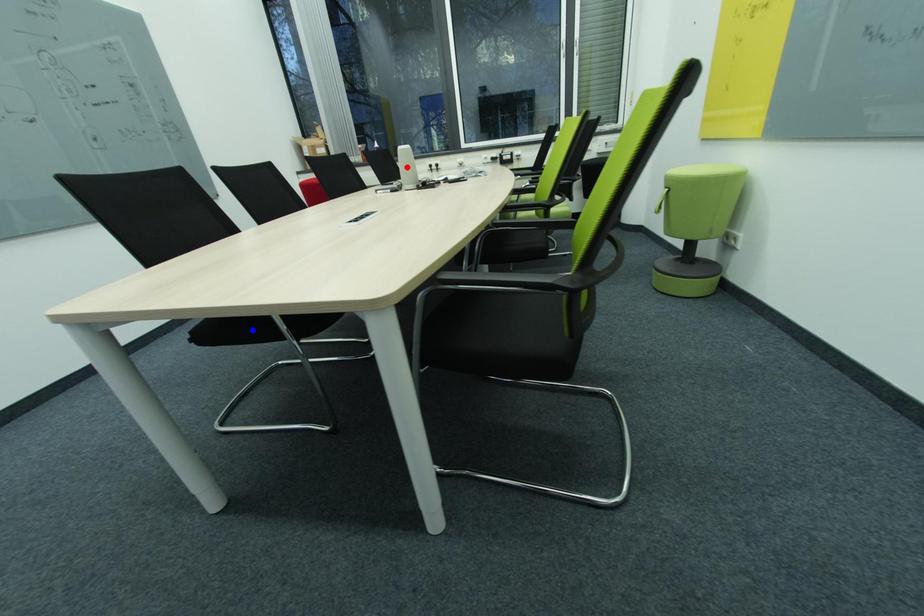
Question: Which of the two points in the image is closer to the camera?

Choices:
 (A) Blue point is closer.
 (B) Red point is closer.

Answer: (A)